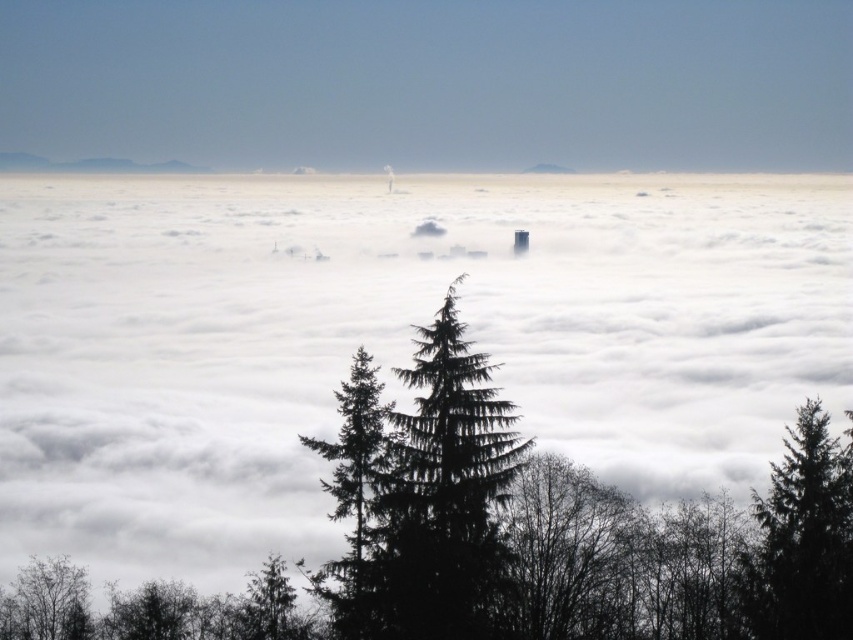
Is white fluffy cloud at center taller than green textured pine tree at center?

Yes, white fluffy cloud at center is taller than green textured pine tree at center.

I want to click on white fluffy cloud at center, so click(x=387, y=340).

The height and width of the screenshot is (640, 853). What are the coordinates of `white fluffy cloud at center` in the screenshot? It's located at (387, 340).

Is green matte tree at lower right smaller than gray foggy peak at center?

No.

Can you confirm if green matte tree at lower right is bigger than gray foggy peak at center?

Yes, green matte tree at lower right is bigger than gray foggy peak at center.

You are a GUI agent. You are given a task and a screenshot of the screen. Output one action in this format:
    pyautogui.click(x=<x>, y=<y>)
    Task: Click on the green matte tree at lower right
    Image resolution: width=853 pixels, height=640 pixels.
    Given the screenshot: What is the action you would take?
    pyautogui.click(x=804, y=540)

You are a GUI agent. You are given a task and a screenshot of the screen. Output one action in this format:
    pyautogui.click(x=<x>, y=<y>)
    Task: Click on the green matte tree at lower right
    
    Given the screenshot: What is the action you would take?
    pyautogui.click(x=804, y=540)

Identify the location of green matte tree at lower right. (804, 540).